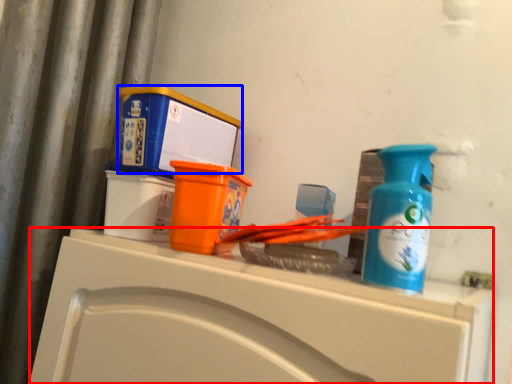
Question: Which object appears farthest to the camera in this image, counter (highlighted by a red box) or box (highlighted by a blue box)?

Choices:
 (A) counter
 (B) box

Answer: (B)